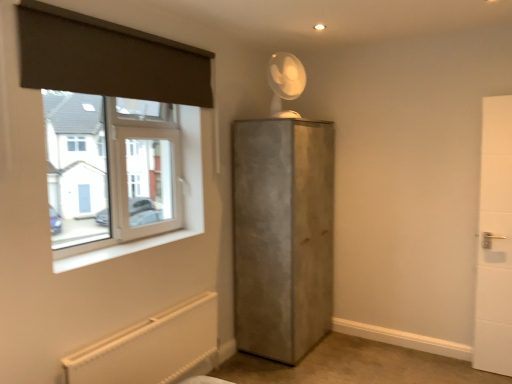
In order to face white plastic window at upper left, should I rotate leftwards or rightwards?

To face it directly, rotate left by 17.584 degrees.

The height and width of the screenshot is (384, 512). What do you see at coordinates (108, 58) in the screenshot? I see `dark gray fabric at upper left` at bounding box center [108, 58].

Identify the location of white textured radiator at lower left. (151, 347).

Where is `transparent plastic fan at upper center`? transparent plastic fan at upper center is located at coordinates (285, 82).

The width and height of the screenshot is (512, 384). What are the coordinates of `concrete cabinet at center, acting as the first door starting from the left` in the screenshot? It's located at (282, 235).

What are the coordinates of `white smooth window sill at lower left` in the screenshot? It's located at (123, 249).

Does white plastic window at upper left have a lesser height compared to white textured radiator at lower left?

Incorrect, the height of white plastic window at upper left does not fall short of that of white textured radiator at lower left.

From the image's perspective, which is above, white plastic window at upper left or white textured radiator at lower left?

white plastic window at upper left is shown above in the image.

From a real-world perspective, is white plastic window at upper left physically above white textured radiator at lower left?

Indeed, from a real-world perspective, white plastic window at upper left stands above white textured radiator at lower left.

Does point (76, 184) come behind point (215, 351)?

That is False.

Between white plastic window at upper left and transparent plastic fan at upper center, which one has larger size?

With larger size is white plastic window at upper left.

Is point (52, 162) positioned after point (282, 74)?

No, it is not.

From the image's perspective, is concrete cabinet at center, which is counted as the second door, starting from the right, on transparent plastic fan at upper center?

Actually, concrete cabinet at center, which is counted as the second door, starting from the right, appears below transparent plastic fan at upper center in the image.

Is there a large distance between concrete cabinet at center, acting as the first door starting from the left, and transparent plastic fan at upper center?

No, concrete cabinet at center, acting as the first door starting from the left, is not far away from transparent plastic fan at upper center.

From a real-world perspective, is concrete cabinet at center, acting as the first door starting from the left, on top of transparent plastic fan at upper center?

No.

Is concrete cabinet at center, which is counted as the second door, starting from the right, facing towards transparent plastic fan at upper center?

No, concrete cabinet at center, which is counted as the second door, starting from the right, is not oriented towards transparent plastic fan at upper center.

Is transparent plastic fan at upper center shorter than white textured radiator at lower left?

Yes, transparent plastic fan at upper center is shorter than white textured radiator at lower left.

Which point is more distant from viewer, (x=291, y=73) or (x=153, y=377)?

The point (x=291, y=73) is farther from the camera.

From a real-world perspective, which is physically above, transparent plastic fan at upper center or white textured radiator at lower left?

transparent plastic fan at upper center is physically above.

Looking at the image, does transparent plastic fan at upper center seem bigger or smaller compared to white textured radiator at lower left?

Clearly, transparent plastic fan at upper center is smaller in size than white textured radiator at lower left.

Is concrete cabinet at center, which is counted as the second door, starting from the right, located outside white smooth window sill at lower left?

Absolutely, concrete cabinet at center, which is counted as the second door, starting from the right, is external to white smooth window sill at lower left.

Is concrete cabinet at center, acting as the first door starting from the left, to the right of white smooth window sill at lower left from the viewer's perspective?

Correct, you'll find concrete cabinet at center, acting as the first door starting from the left, to the right of white smooth window sill at lower left.

This screenshot has width=512, height=384. I want to click on window sill above the concrete cabinet at center, which is counted as the second door, starting from the right (from a real-world perspective), so click(x=123, y=249).

Is concrete cabinet at center, acting as the first door starting from the left, oriented away from white smooth window sill at lower left?

No, concrete cabinet at center, acting as the first door starting from the left, is not facing away from white smooth window sill at lower left.

In the image, is white textured radiator at lower left on the left side or the right side of dark gray fabric at upper left?

Clearly, white textured radiator at lower left is on the right of dark gray fabric at upper left in the image.

Which is behind, point (156, 383) or point (158, 45)?

Point (156, 383)

Who is shorter, white textured radiator at lower left or dark gray fabric at upper left?

Standing shorter between the two is dark gray fabric at upper left.

From their relative heights in the image, would you say dark gray fabric at upper left is taller or shorter than white tile door at right, which is the 2th door from left to right?

Clearly, dark gray fabric at upper left is shorter compared to white tile door at right, which is the 2th door from left to right.

Does point (168, 97) lie behind point (490, 193)?

No, (168, 97) is in front of (490, 193).

Considering the positions of objects dark gray fabric at upper left and white tile door at right, which is the 1th door in right-to-left order, in the image provided, who is behind, dark gray fabric at upper left or white tile door at right, which is the 1th door in right-to-left order,?

white tile door at right, which is the 1th door in right-to-left order, is more distant.

Identify the location of window positioned vertically above the white textured radiator at lower left (from a real-world perspective). (110, 170).

Where is `fan behind the white plastic window at upper left`? Image resolution: width=512 pixels, height=384 pixels. fan behind the white plastic window at upper left is located at coordinates (285, 82).

From the image, which object appears to be nearer to dark gray fabric at upper left, concrete cabinet at center, which is counted as the second door, starting from the right, or transparent plastic fan at upper center?

transparent plastic fan at upper center lies closer to dark gray fabric at upper left than the other object.

Which object lies further to the anchor point white textured radiator at lower left, white tile door at right, which is the 2th door from left to right, or white plastic window at upper left?

white tile door at right, which is the 2th door from left to right, is further to white textured radiator at lower left.

Which object lies further to the anchor point concrete cabinet at center, acting as the first door starting from the left, white plastic window at upper left or white textured radiator at lower left?

Based on the image, white plastic window at upper left appears to be further to concrete cabinet at center, acting as the first door starting from the left.

Which object lies further to the anchor point transparent plastic fan at upper center, dark gray fabric at upper left or white tile door at right, which is the 2th door from left to right?

Based on the image, white tile door at right, which is the 2th door from left to right, appears to be further to transparent plastic fan at upper center.

Which object lies further to the anchor point white smooth window sill at lower left, transparent plastic fan at upper center or white textured radiator at lower left?

transparent plastic fan at upper center is further to white smooth window sill at lower left.

From the image, which object appears to be nearer to white smooth window sill at lower left, transparent plastic fan at upper center or concrete cabinet at center, acting as the first door starting from the left?

concrete cabinet at center, acting as the first door starting from the left, lies closer to white smooth window sill at lower left than the other object.

Which object lies nearer to the anchor point white plastic window at upper left, concrete cabinet at center, which is counted as the second door, starting from the right, or white tile door at right, which is the 1th door in right-to-left order?

Among the two, concrete cabinet at center, which is counted as the second door, starting from the right, is located nearer to white plastic window at upper left.

From the image, which object appears to be nearer to concrete cabinet at center, which is counted as the second door, starting from the right, transparent plastic fan at upper center or white plastic window at upper left?

The object closer to concrete cabinet at center, which is counted as the second door, starting from the right, is white plastic window at upper left.

Find the location of a particular element. fan between dark gray fabric at upper left and concrete cabinet at center, acting as the first door starting from the left, in the front-back direction is located at coordinates (285, 82).

The image size is (512, 384). Find the location of `radiator located between white smooth window sill at lower left and concrete cabinet at center, acting as the first door starting from the left, in the left-right direction`. radiator located between white smooth window sill at lower left and concrete cabinet at center, acting as the first door starting from the left, in the left-right direction is located at coordinates (151, 347).

At what (x,y) coordinates should I click in order to perform the action: click on window sill between white plastic window at upper left and concrete cabinet at center, acting as the first door starting from the left. Please return your answer as a coordinate pair (x, y). The image size is (512, 384). Looking at the image, I should click on (123, 249).

The width and height of the screenshot is (512, 384). What are the coordinates of `curtain between white smooth window sill at lower left and white tile door at right, which is the 2th door from left to right` in the screenshot? It's located at (108, 58).